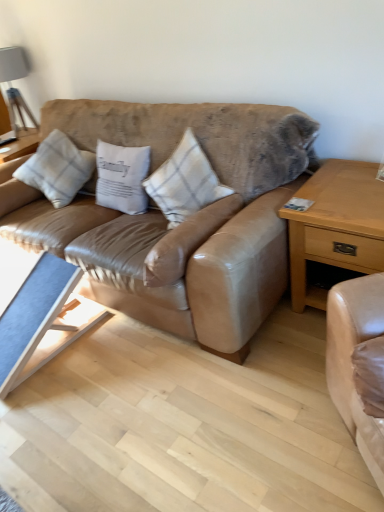
The width and height of the screenshot is (384, 512). I want to click on vacant space in front of blue fabric coffee table at lower left, so click(x=57, y=408).